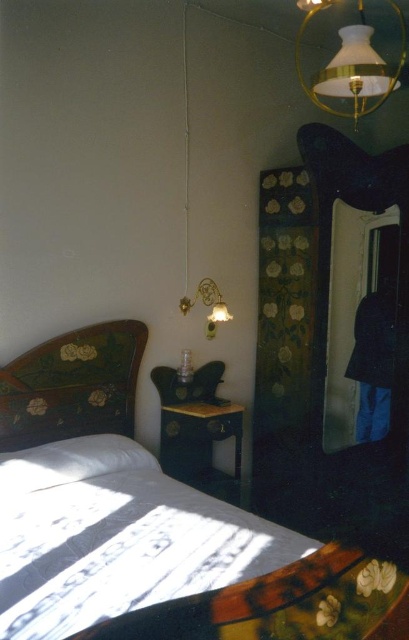
Question: Which is nearer to the shiny silver mirror at right?

Choices:
 (A) wooden floral-patterned headboard at left
 (B) matte gold lampshade at upper right

Answer: (B)

Question: Which object is the closest to the wooden glossy nightstand at lower center?

Choices:
 (A) shiny silver mirror at right
 (B) wooden floral-patterned headboard at left
 (C) matte gold sconce at upper right
 (D) wooden bed with floral pattern at center

Answer: (D)

Question: Which is nearer to the matte gold lampshade at upper right?

Choices:
 (A) wooden floral-patterned headboard at left
 (B) wooden bed with floral pattern at center
 (C) white soft pillow at lower left

Answer: (B)

Question: Is wooden bed with floral pattern at center wider than wooden glossy nightstand at lower center?

Choices:
 (A) no
 (B) yes

Answer: (B)

Question: Is matte gold lampshade at upper right to the right of white soft pillow at lower left from the viewer's perspective?

Choices:
 (A) no
 (B) yes

Answer: (B)

Question: Can you confirm if wooden floral-patterned headboard at left is positioned below wooden glossy nightstand at lower center?

Choices:
 (A) yes
 (B) no

Answer: (B)